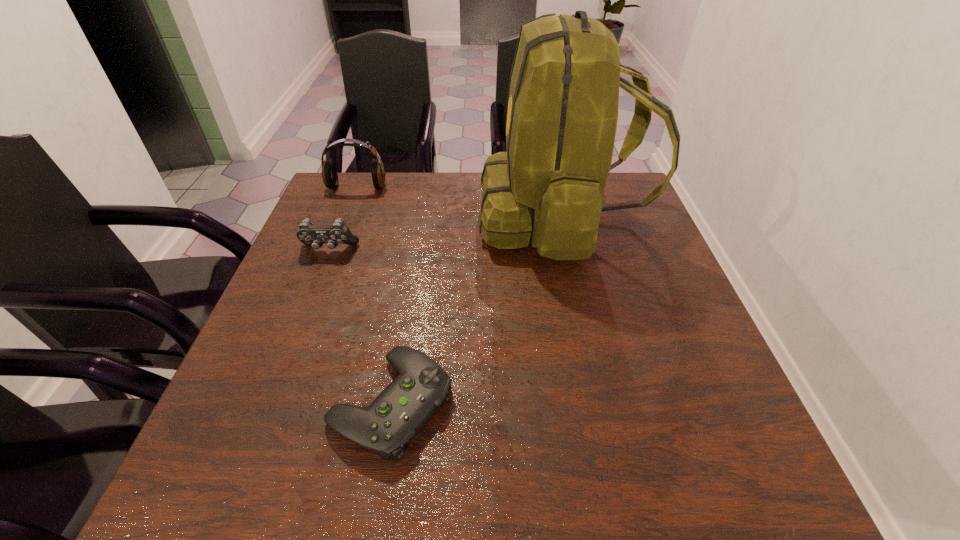
Identify the location of unoccupied position between the headset and the farther control. Image resolution: width=960 pixels, height=540 pixels. (343, 219).

At what (x,y) coordinates should I click in order to perform the action: click on free space between the backpack and the second tallest object. Please return your answer as a coordinate pair (x, y). The image size is (960, 540). Looking at the image, I should click on (459, 202).

Identify the location of blank region between the nearer control and the headset. Image resolution: width=960 pixels, height=540 pixels. (374, 295).

Locate an element on the screen. empty space between the second tallest object and the second shortest object is located at coordinates (343, 219).

Locate an element on the screen. The image size is (960, 540). free space that is in between the shorter control and the backpack is located at coordinates (476, 310).

Identify which object is the second closest to the second tallest object. Please provide its 2D coordinates. Your answer should be formatted as a tuple, i.e. [(x, y)], where the tuple contains the x and y coordinates of a point satisfying the conditions above.

[(562, 111)]

Choose which object is the third nearest neighbor to the third shortest object. Please provide its 2D coordinates. Your answer should be formatted as a tuple, i.e. [(x, y)], where the tuple contains the x and y coordinates of a point satisfying the conditions above.

[(399, 413)]

Locate an element on the screen. free space that satisfies the following two spatial constraints: 1. on the front-facing side of the rightmost object; 2. on the surface of the second shortest object with buttons is located at coordinates (568, 249).

The image size is (960, 540). What are the coordinates of `free spot that satisfies the following two spatial constraints: 1. on the surface of the third tallest object with buttons; 2. on the right side of the shorter control` in the screenshot? It's located at (269, 403).

Locate an element on the screen. free point that satisfies the following two spatial constraints: 1. on the surface of the shorter control with buttons; 2. on the left side of the farther control is located at coordinates (269, 403).